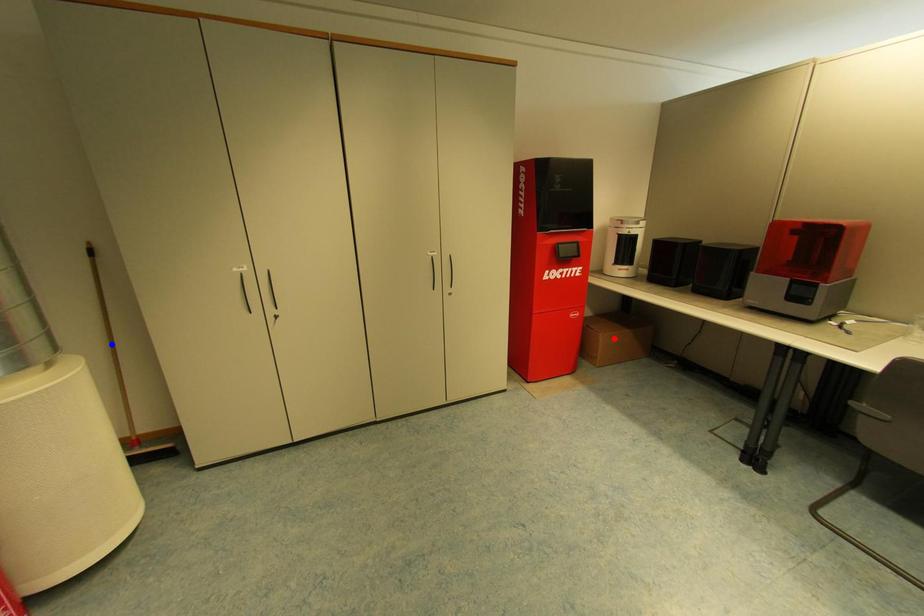
Question: In the image, two points are highlighted. Which point is nearer to the camera? Reply with the corresponding letter.

Choices:
 (A) blue point
 (B) red point

Answer: (A)